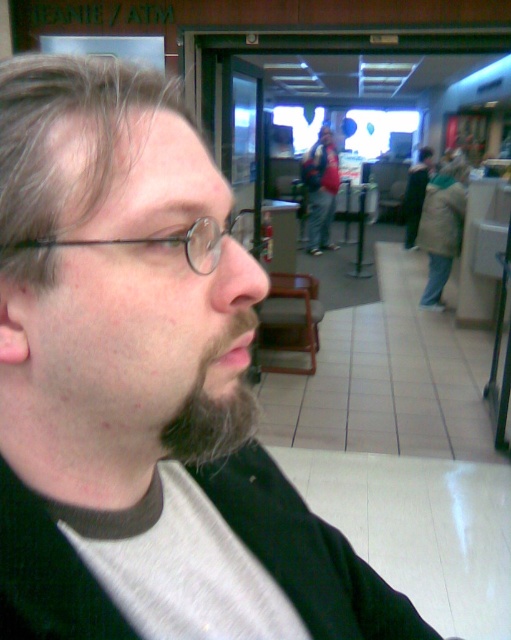
You are a photographer trying to capture a candid shot of the person with the dark brown fuzzy beard at lower left and the matte black backpack at center. Since you want to include both in the frame, which direction should you position yourself relative to the backpack to ensure the beard is also visible?

You should position yourself to the right of the matte black backpack at center because the dark brown fuzzy beard at lower left is located to the left of it, so facing towards the left side would allow both to be in the frame.

You are a photographer trying to capture a photo of the black metal glasses at left and the matte black backpack at center. Since you want both objects to appear equally sized in the final image, which object should you move closer to the camera?

The black metal glasses at left has a lesser width compared to matte black backpack at center. To make them appear equally sized in the photo, you should move the black metal glasses at left closer to the camera since it is smaller in size and needs to be magnified more to match the backpack.